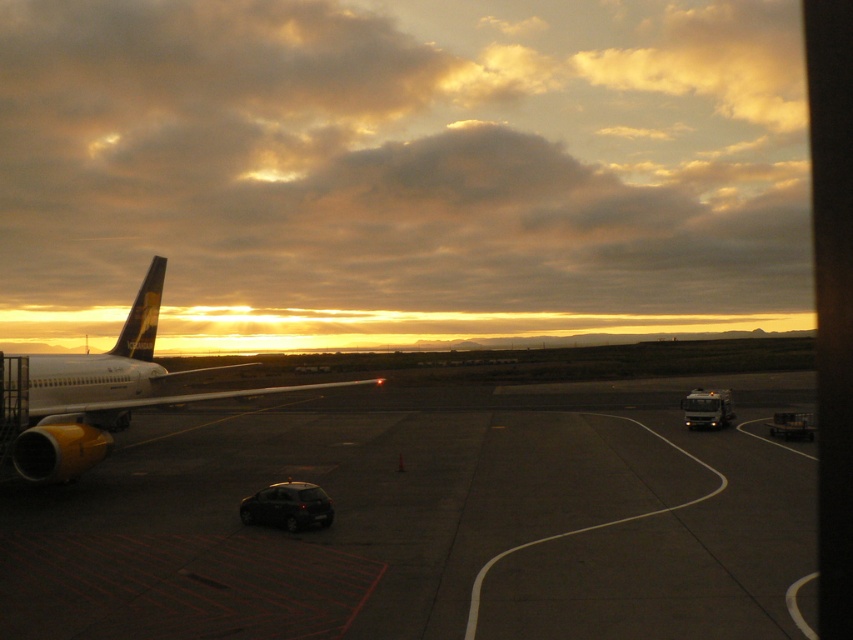
You are standing at the point with coordinates point (300, 528) on the airport tarmac. You want to walk towards the airplane parked on the left side of the frame. Will the point (97, 410) block your path?

Point (97, 410) is behind point (300, 528), so it will not block your path to the airplane parked on the left side of the frame.

You are standing on the airport tarmac and see the shiny black car at lower center and the metallic silver cart at lower right. Which object is nearer to you?

The shiny black car at lower center is closer to the viewer than the metallic silver cart at lower right.

You are standing on the airport tarmac and see two points marked on the ground. The first point is at coordinate point (265,493) and the second is at point (810,417). Which point is closer to you?

Point (265,493) is closer to the viewer than point (810,417).